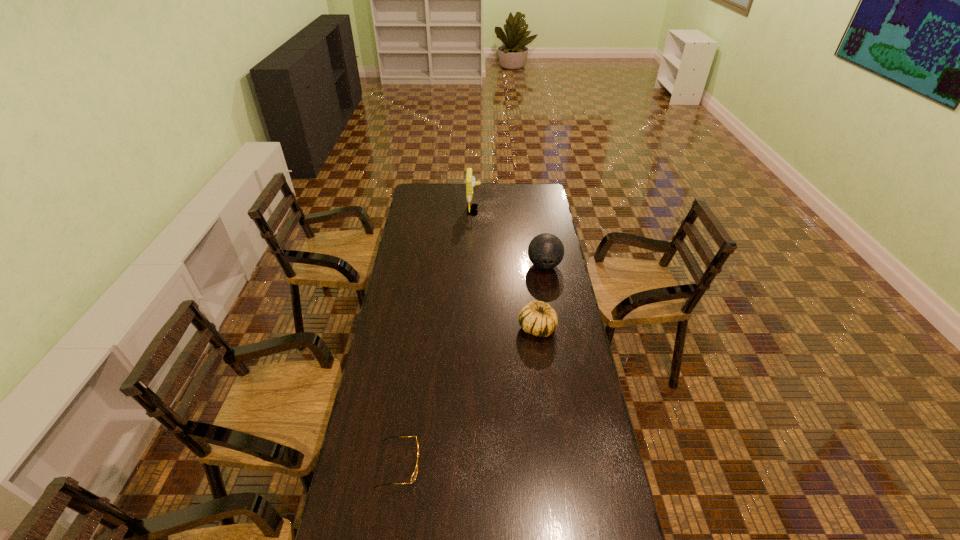
You are a GUI agent. You are given a task and a screenshot of the screen. Output one action in this format:
    pyautogui.click(x=<x>, y=<y>)
    Task: Click on the vacant region between the second nearest object and the nearest object
    This screenshot has height=540, width=960.
    Given the screenshot: What is the action you would take?
    click(468, 396)

Image resolution: width=960 pixels, height=540 pixels. In order to click on free space that is in between the third nearest object and the spectacles in this screenshot , I will do `click(471, 365)`.

The height and width of the screenshot is (540, 960). Find the location of `vacant space in between the second tallest object and the second nearest object`. vacant space in between the second tallest object and the second nearest object is located at coordinates (540, 296).

Where is `blank region between the tallest object and the shortest object`? The height and width of the screenshot is (540, 960). blank region between the tallest object and the shortest object is located at coordinates (437, 338).

This screenshot has height=540, width=960. I want to click on blank region between the third farthest object and the third shortest object, so click(x=540, y=296).

Identify the location of free space between the farthest object and the third tallest object. (506, 269).

At what (x,y) coordinates should I click in order to perform the action: click on empty space that is in between the shortest object and the tallest object. Please return your answer as a coordinate pair (x, y). This screenshot has width=960, height=540. Looking at the image, I should click on coord(437,338).

Identify the location of empty space that is in between the nearest object and the gourd. The height and width of the screenshot is (540, 960). (468, 396).

Locate an element on the screen. free spot between the second farthest object and the leftmost object is located at coordinates (471, 365).

You are a GUI agent. You are given a task and a screenshot of the screen. Output one action in this format:
    pyautogui.click(x=<x>, y=<y>)
    Task: Click on the empty space that is in between the farthest object and the bowling ball
    Image resolution: width=960 pixels, height=540 pixels.
    Given the screenshot: What is the action you would take?
    pyautogui.click(x=509, y=238)